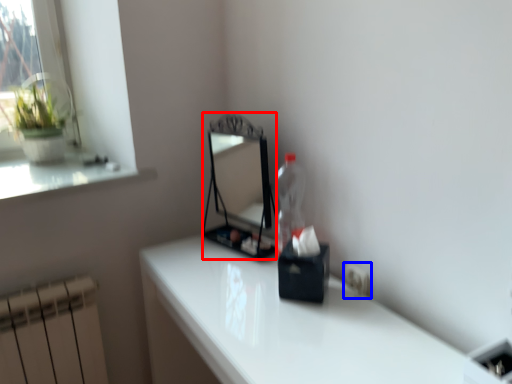
Question: Among these objects, which one is nearest to the camera, mirror (highlighted by a red box) or electric outlet (highlighted by a blue box)?

Choices:
 (A) mirror
 (B) electric outlet

Answer: (B)